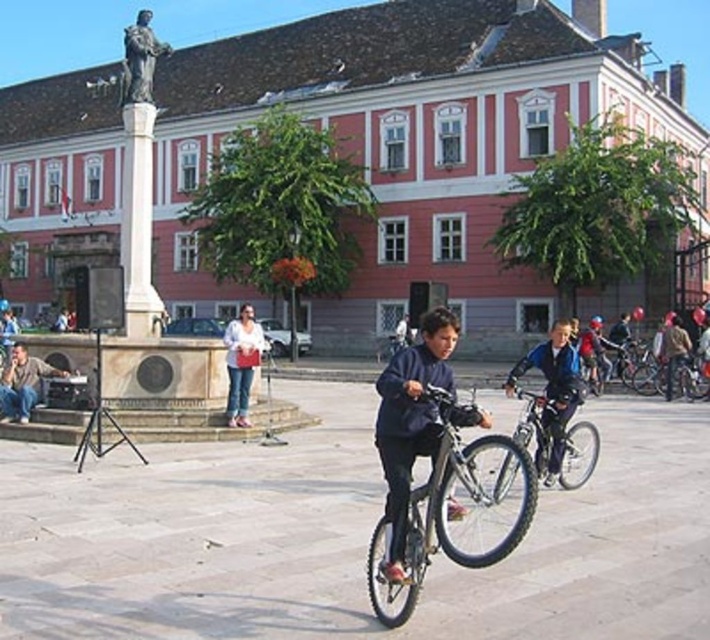
In the scene shown: Is white marble column at center to the right of denim jacket at center from the viewer's perspective?

No, white marble column at center is not to the right of denim jacket at center.

Can you confirm if white marble column at center is taller than denim jacket at center?

Yes.

This screenshot has width=710, height=640. What do you see at coordinates (136, 224) in the screenshot?
I see `white marble column at center` at bounding box center [136, 224].

At what (x,y) coordinates should I click in order to perform the action: click on white marble column at center. Please return your answer as a coordinate pair (x, y). The height and width of the screenshot is (640, 710). Looking at the image, I should click on (136, 224).

Is point (398, 470) positioned behind point (599, 385)?

No, (398, 470) is in front of (599, 385).

Find the location of a particular element. The width and height of the screenshot is (710, 640). dark blue fabric jacket at center is located at coordinates (410, 420).

The image size is (710, 640). I want to click on dark blue fabric jacket at center, so click(410, 420).

How distant is denim jacket at center from matte black jacket at lower left?

denim jacket at center is 5.86 meters away from matte black jacket at lower left.

Does point (231, 397) come closer to viewer compared to point (4, 380)?

That is True.

Which is behind, point (256, 356) or point (21, 368)?

The point (256, 356) is more distant.

Find the location of `denim jacket at center`. denim jacket at center is located at coordinates (241, 364).